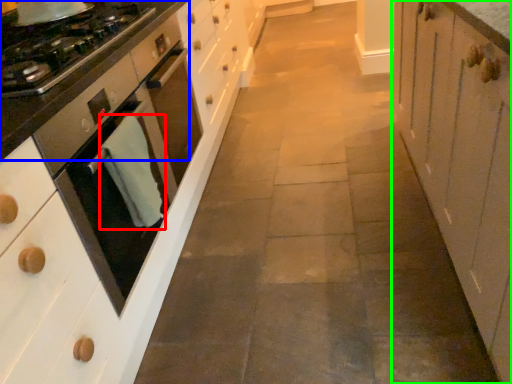
Question: Considering the real-world distances, which object is farthest from material (highlighted by a red box)? countertop (highlighted by a blue box) or cabinetry (highlighted by a green box)?

Choices:
 (A) countertop
 (B) cabinetry

Answer: (B)